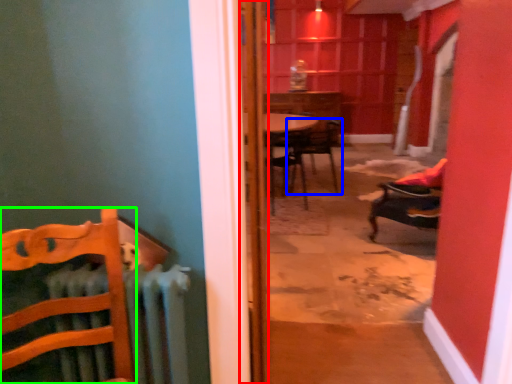
Question: Which object is positioned farthest from door (highlighted by a red box)? Select from chair (highlighted by a blue box) and chair (highlighted by a green box).

Choices:
 (A) chair
 (B) chair

Answer: (A)